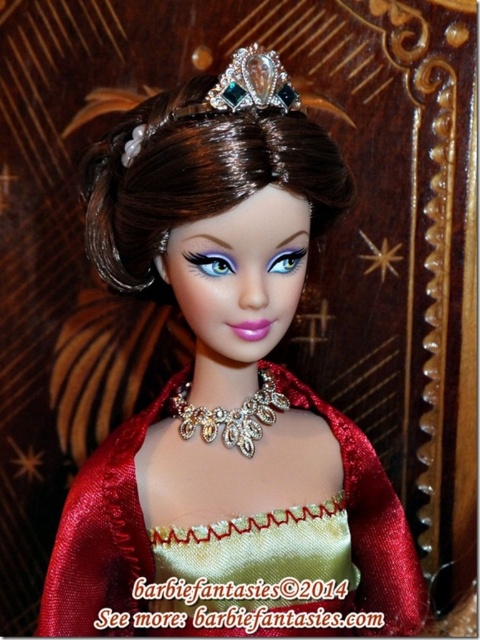
Question: Can you confirm if shiny brown hair at center is positioned above clear crystal tiara at center?

Choices:
 (A) no
 (B) yes

Answer: (A)

Question: Estimate the real-world distances between objects in this image. Which object is closer to the clear crystal tiara at center?

Choices:
 (A) shiny gold fabric dress at center
 (B) shiny brown hair at center

Answer: (B)

Question: Is shiny brown hair at center positioned before clear crystal tiara at center?

Choices:
 (A) yes
 (B) no

Answer: (A)

Question: Is shiny brown hair at center to the left of shiny gold fabric dress at center from the viewer's perspective?

Choices:
 (A) no
 (B) yes

Answer: (B)

Question: Which object is closer to the camera taking this photo?

Choices:
 (A) shiny brown hair at center
 (B) clear crystal tiara at center
 (C) swarovski crystal tiara at center
 (D) shiny gold fabric dress at center

Answer: (A)

Question: Which object is positioned farthest from the swarovski crystal tiara at center?

Choices:
 (A) clear crystal tiara at center
 (B) shiny brown hair at center
 (C) shiny gold fabric dress at center

Answer: (C)